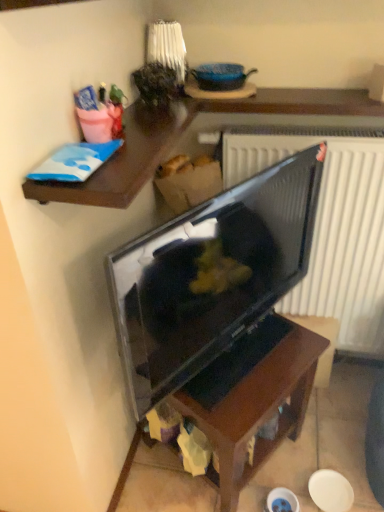
Where is `matte black tv at center`? matte black tv at center is located at coordinates (212, 275).

Does wooden shelf at upper left appear on the right side of matte black tv at center?

In fact, wooden shelf at upper left is to the left of matte black tv at center.

In the image, is wooden shelf at upper left positioned in front of or behind matte black tv at center?

Visually, wooden shelf at upper left is located behind matte black tv at center.

Based on the photo, which is closer to the camera, (x=145, y=122) or (x=206, y=352)?

Positioned in front is point (x=145, y=122).

Considering the sizes of objects matte black tv at center and wooden shelf at upper left in the image provided, who is wider, matte black tv at center or wooden shelf at upper left?

wooden shelf at upper left is wider.

Based on the photo, in the image, is matte black tv at center positioned in front of or behind wooden shelf at upper left?

In the image, matte black tv at center appears in front of wooden shelf at upper left.

Consider the image. Is matte black tv at center oriented towards wooden shelf at upper left?

No, matte black tv at center is not facing towards wooden shelf at upper left.

How far apart are matte black tv at center and wooden shelf at upper left?

They are 13.87 inches apart.

Based on the photo, is matte black tv at center located within dark wood table at center?

No.

Is dark wood table at center oriented towards matte black tv at center?

No, dark wood table at center is not aimed at matte black tv at center.

From the image's perspective, is dark wood table at center below matte black tv at center?

Correct, dark wood table at center appears lower than matte black tv at center in the image.

Considering the sizes of dark wood table at center and matte black tv at center in the image, is dark wood table at center bigger or smaller than matte black tv at center?

Clearly, dark wood table at center is larger in size than matte black tv at center.

Between point (123, 157) and point (232, 433), which one is positioned behind?

The point (232, 433) is farther.

Does wooden shelf at upper left have a lesser width compared to dark wood table at center?

In fact, wooden shelf at upper left might be wider than dark wood table at center.

Is wooden shelf at upper left taller than dark wood table at center?

Incorrect, the height of wooden shelf at upper left is not larger of that of dark wood table at center.

Does matte black tv at center turn towards dark wood table at center?

No.

From a real-world perspective, does matte black tv at center stand above dark wood table at center?

Yes.

Is matte black tv at center not inside dark wood table at center?

Yes, matte black tv at center is not within dark wood table at center.

There is a dark wood table at center. Identify the location of television above it (from a real-world perspective). The width and height of the screenshot is (384, 512). (212, 275).

The height and width of the screenshot is (512, 384). In order to click on desk on the left of dark wood table at center in this screenshot , I will do `click(183, 135)`.

Is dark wood table at center in front of or behind wooden shelf at upper left in the image?

In the image, dark wood table at center appears behind wooden shelf at upper left.

Does dark wood table at center have a lesser height compared to wooden shelf at upper left?

In fact, dark wood table at center may be taller than wooden shelf at upper left.

From a real-world perspective, is dark wood table at center positioned under wooden shelf at upper left based on gravity?

Yes, from a real-world perspective, dark wood table at center is under wooden shelf at upper left.

There is a matte black tv at center. Where is `desk above it (from a real-world perspective)`? desk above it (from a real-world perspective) is located at coordinates (183, 135).

Where is `desk above the matte black tv at center (from the image's perspective)`? Image resolution: width=384 pixels, height=512 pixels. desk above the matte black tv at center (from the image's perspective) is located at coordinates (183, 135).

When comparing their distances from wooden shelf at upper left, does matte black tv at center or dark wood table at center seem closer?

matte black tv at center is positioned closer to the anchor wooden shelf at upper left.

Which object lies further to the anchor point dark wood table at center, matte black tv at center or wooden shelf at upper left?

Among the two, wooden shelf at upper left is located further to dark wood table at center.

Estimate the real-world distances between objects in this image. Which object is further from matte black tv at center, dark wood table at center or wooden shelf at upper left?

wooden shelf at upper left.

Looking at the image, which one is located further to dark wood table at center, wooden shelf at upper left or matte black tv at center?

wooden shelf at upper left is positioned further to the anchor dark wood table at center.

Which object lies nearer to the anchor point matte black tv at center, wooden shelf at upper left or dark wood table at center?

Based on the image, dark wood table at center appears to be nearer to matte black tv at center.

Based on their spatial positions, is dark wood table at center or matte black tv at center further from wooden shelf at upper left?

dark wood table at center.

You are a GUI agent. You are given a task and a screenshot of the screen. Output one action in this format:
    pyautogui.click(x=<x>, y=<y>)
    Task: Click on the television between wooden shelf at upper left and dark wood table at center in the up-down direction
    This screenshot has width=384, height=512.
    Given the screenshot: What is the action you would take?
    (x=212, y=275)